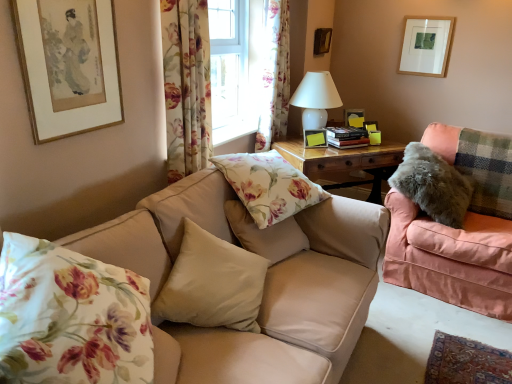
Question: Is beige fabric pillow at center, the fourth pillow in the right-to-left sequence, far away from beige fabric couch at center, arranged as the first studio couch when viewed from the left?

Choices:
 (A) yes
 (B) no

Answer: (B)

Question: Does beige fabric pillow at center, the fourth pillow in the right-to-left sequence, have a lesser width compared to beige fabric couch at center, which is the second studio couch from right to left?

Choices:
 (A) yes
 (B) no

Answer: (A)

Question: Can you confirm if beige fabric pillow at center, positioned as the 2th pillow in left-to-right order, is shorter than beige fabric couch at center, which is the second studio couch from right to left?

Choices:
 (A) no
 (B) yes

Answer: (B)

Question: Can you confirm if beige fabric pillow at center, positioned as the 2th pillow in left-to-right order, is wider than beige fabric couch at center, arranged as the first studio couch when viewed from the left?

Choices:
 (A) yes
 (B) no

Answer: (B)

Question: From the image's perspective, does beige fabric pillow at center, the fourth pillow in the right-to-left sequence, appear lower than beige fabric couch at center, which is the second studio couch from right to left?

Choices:
 (A) no
 (B) yes

Answer: (A)

Question: Considering the positions of point (278, 183) and point (288, 269), is point (278, 183) closer or farther from the camera than point (288, 269)?

Choices:
 (A) closer
 (B) farther

Answer: (B)

Question: Is floral fabric pillow at center, which is the fourth pillow from left to right, bigger or smaller than beige fabric couch at center, arranged as the first studio couch when viewed from the left?

Choices:
 (A) big
 (B) small

Answer: (B)

Question: From the image's perspective, relative to beige fabric couch at center, arranged as the first studio couch when viewed from the left, is floral fabric pillow at center, which is the fourth pillow from left to right, above or below?

Choices:
 (A) above
 (B) below

Answer: (A)

Question: In the image, is floral fabric pillow at center, the second pillow positioned from the right, on the left side or the right side of beige fabric couch at center, which is the second studio couch from right to left?

Choices:
 (A) right
 (B) left

Answer: (A)

Question: In terms of width, does fluffy pink couch at right, marked as the second studio couch in a left-to-right arrangement, look wider or thinner when compared to fuzzy gray pillow at right, which appears as the first pillow when viewed from the right?

Choices:
 (A) wide
 (B) thin

Answer: (A)

Question: Relative to fuzzy gray pillow at right, the fifth pillow from the left, is fluffy pink couch at right, marked as the second studio couch in a left-to-right arrangement, in front or behind?

Choices:
 (A) behind
 (B) front

Answer: (B)

Question: From a real-world perspective, relative to fuzzy gray pillow at right, which appears as the first pillow when viewed from the right, is fluffy pink couch at right, which is the 1th studio couch in right-to-left order, vertically above or below?

Choices:
 (A) below
 (B) above

Answer: (A)

Question: Which is correct: fluffy pink couch at right, which is the 1th studio couch in right-to-left order, is inside fuzzy gray pillow at right, which appears as the first pillow when viewed from the right, or outside of it?

Choices:
 (A) inside
 (B) outside

Answer: (B)

Question: Considering the positions of floral fabric curtain at upper center, which is the second curtain in front-to-back order, and white glossy table lamp at upper center in the image, is floral fabric curtain at upper center, which is the second curtain in front-to-back order, bigger or smaller than white glossy table lamp at upper center?

Choices:
 (A) small
 (B) big

Answer: (A)

Question: Is point (279, 43) closer or farther from the camera than point (297, 91)?

Choices:
 (A) closer
 (B) farther

Answer: (A)